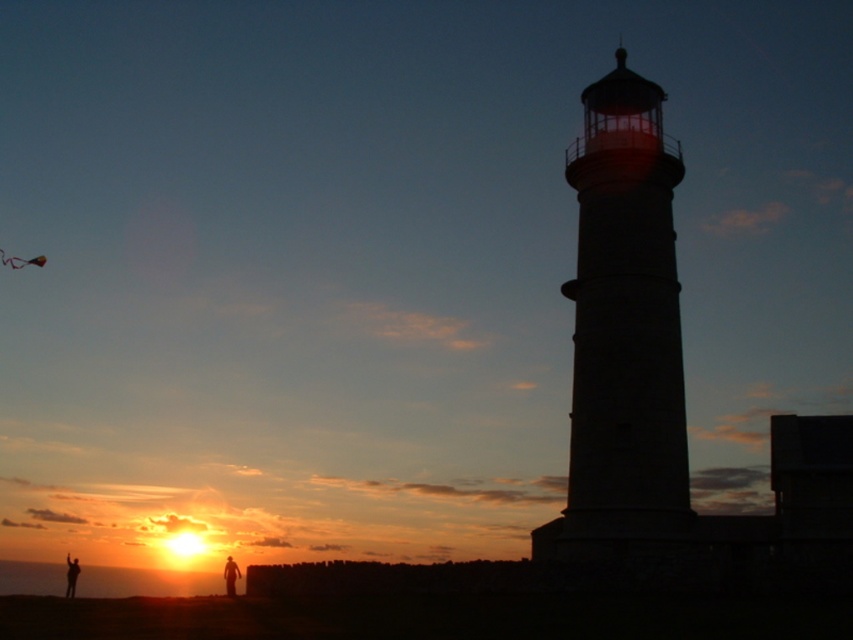
You are a photographer trying to capture the sunset scene with the multicolored fabric kite at upper left and the silhouette figure at lower center. Which object appears narrower in your photo?

The multicolored fabric kite at upper left appears narrower than the silhouette figure at lower center.

You are standing at the lighthouse and looking towards the two points marked in the scene. Which point, point (15,260) or point (71,596), is closer to you?

Point (15,260) is closer to you because it is further to the camera than point (71,596).

You are a photographer trying to capture the sunset with both silhouette figure at lower center and silhouette figure at lower left in the frame. Which figure appears smaller in the photo?

The silhouette figure at lower center appears smaller because it has a lesser width compared to the silhouette figure at lower left.